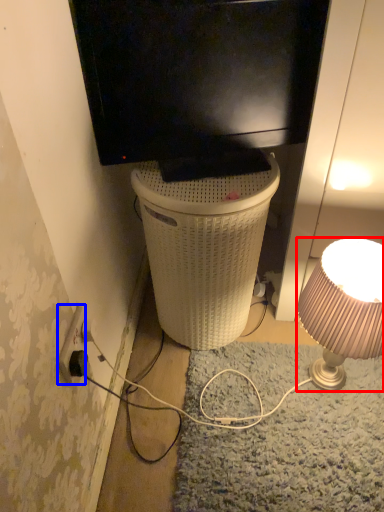
Question: Which object appears farthest to the camera in this image, lamp (highlighted by a red box) or power outlet (highlighted by a blue box)?

Choices:
 (A) lamp
 (B) power outlet

Answer: (A)